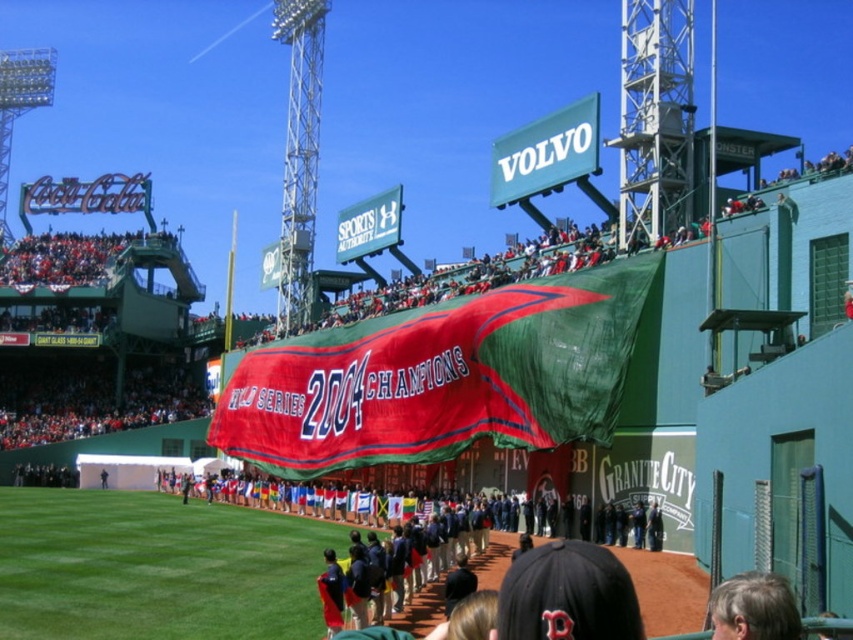
Question: Does red fabric banner at center appear on the left side of gray hair at lower right?

Choices:
 (A) yes
 (B) no

Answer: (A)

Question: Can you confirm if red fabric banner at center is positioned to the right of gray hair at lower right?

Choices:
 (A) yes
 (B) no

Answer: (B)

Question: In this image, where is red fabric banner at center located relative to gray hair at lower right?

Choices:
 (A) below
 (B) above

Answer: (B)

Question: Among these points, which one is nearest to the camera?

Choices:
 (A) tap(786, 636)
 (B) tap(486, 403)

Answer: (A)

Question: Which object appears closest to the camera in this image?

Choices:
 (A) red fabric banner at center
 (B) gray hair at lower right

Answer: (B)